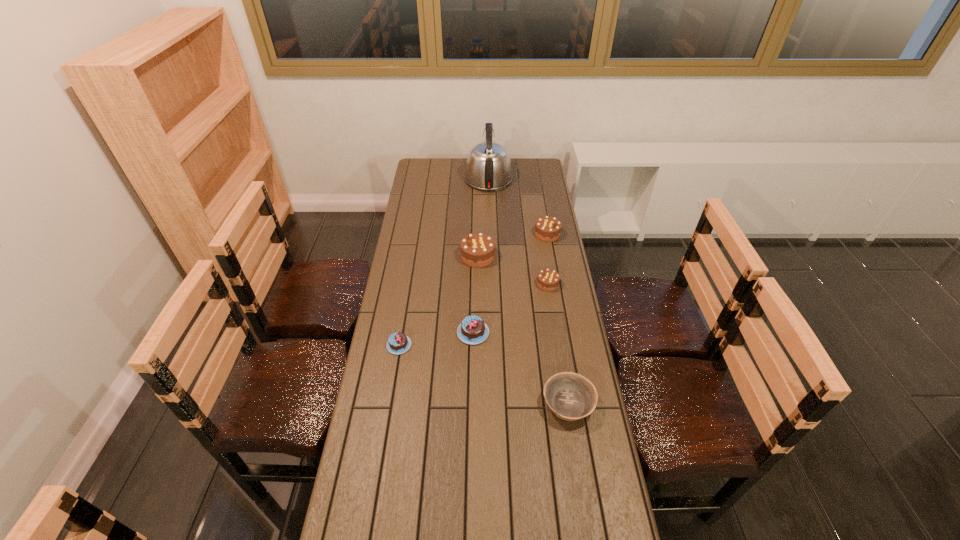
This screenshot has width=960, height=540. Find the location of `free space that satisfies the following two spatial constraints: 1. on the back side of the farthest chocolate cake; 2. on the right side of the bowl`. free space that satisfies the following two spatial constraints: 1. on the back side of the farthest chocolate cake; 2. on the right side of the bowl is located at coordinates (541, 234).

I want to click on free spot that satisfies the following two spatial constraints: 1. on the back side of the nearest brown chocolate cake; 2. on the left side of the shortest object, so click(409, 284).

The height and width of the screenshot is (540, 960). What are the coordinates of `blank space that satisfies the following two spatial constraints: 1. on the back side of the bigger pink chocolate cake; 2. on the left side of the nearest brown chocolate cake` in the screenshot? It's located at coord(474,284).

In order to click on free point that satisfies the following two spatial constraints: 1. on the back side of the third farthest object; 2. on the right side of the right pink chocolate cake in this screenshot , I will do `click(474, 256)`.